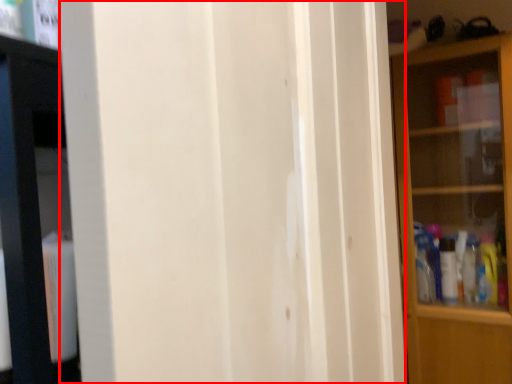
Question: From the image's perspective, considering the relative positions of screen door (annotated by the red box) and shelf in the image provided, where is screen door (annotated by the red box) located with respect to the staircase?

Choices:
 (A) above
 (B) below

Answer: (A)